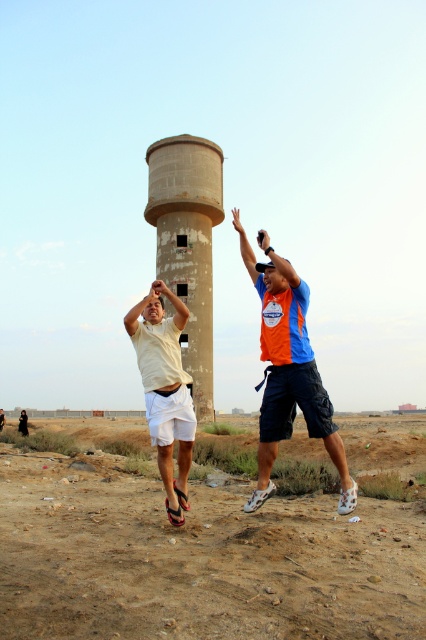
You are a photographer trying to capture a photo of the white matte shorts at center without the concrete water tower at center appearing in the foreground. Is this possible given their positions?

The concrete water tower at center is above the white matte shorts at center, so it is in the foreground. To avoid capturing the tower in the foreground, you would need to adjust your angle or position to frame the shorts without the tower obstructing the view.

You are standing on the brown sandy dirt at lower center and want to reach the orange fabric shirt at center. Is the shirt in front of you or behind you?

The brown sandy dirt at lower center is in front of the orange fabric shirt at center, so the shirt is behind you.